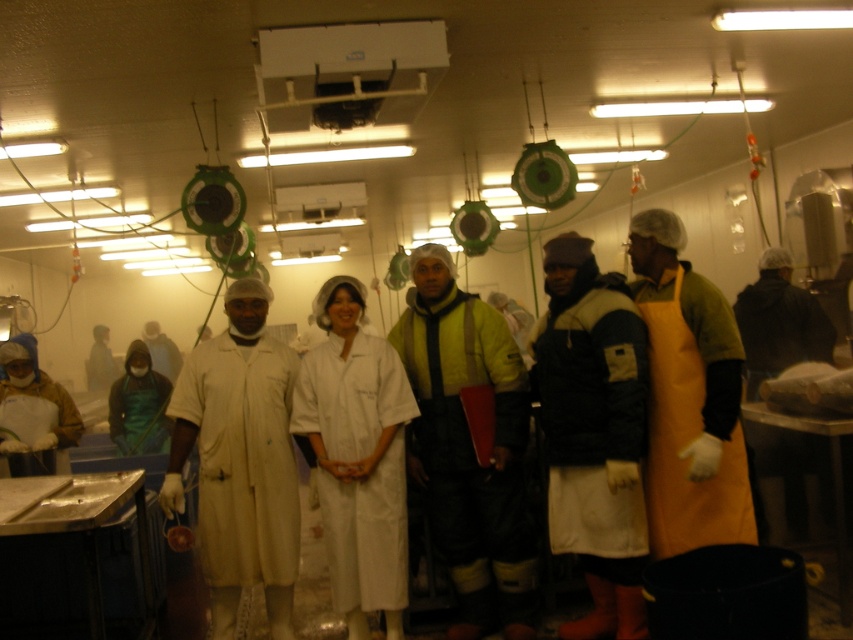
Question: Which of the following is the closest to the observer?

Choices:
 (A) (265, 452)
 (B) (637, 452)
 (C) (448, 452)
 (D) (694, 545)

Answer: (B)

Question: Where is yellow matte jacket at center located in relation to matte white lab coat at center in the image?

Choices:
 (A) below
 (B) above

Answer: (B)

Question: Which of the following is the closest to the observer?

Choices:
 (A) matte white lab coat at center
 (B) white fabric apron at center
 (C) orange leather apron at center

Answer: (C)

Question: Does yellow matte jacket at center have a greater width compared to matte white lab coat at center?

Choices:
 (A) yes
 (B) no

Answer: (A)

Question: Which point appears farthest from the camera in this image?

Choices:
 (A) (735, 444)
 (B) (422, 369)
 (C) (582, 384)

Answer: (B)

Question: In this image, where is yellow matte jacket at center located relative to matte white lab coat at center?

Choices:
 (A) left
 (B) right

Answer: (B)